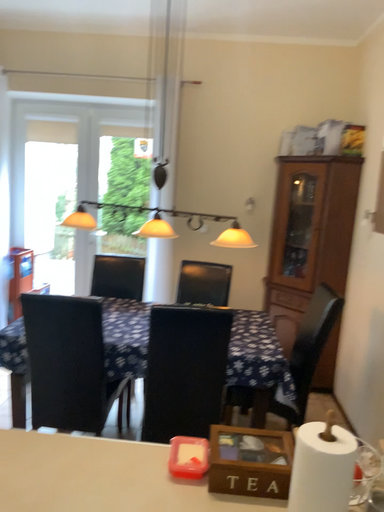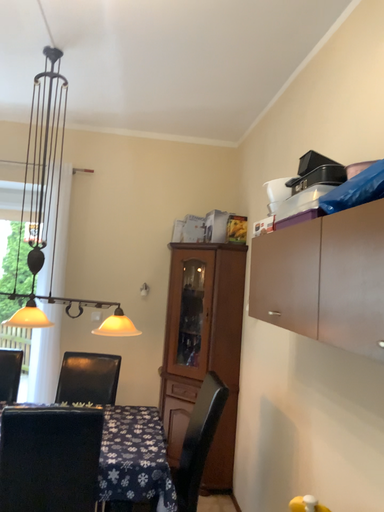
Question: How did the camera likely rotate when shooting the video?

Choices:
 (A) rotated left
 (B) rotated right

Answer: (B)